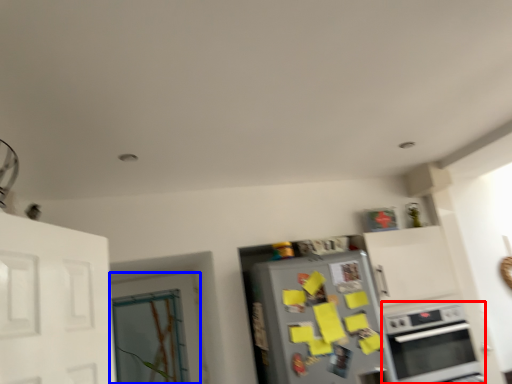
Question: Which object is closer to the camera taking this photo, oven (highlighted by a red box) or door (highlighted by a blue box)?

Choices:
 (A) oven
 (B) door

Answer: (A)